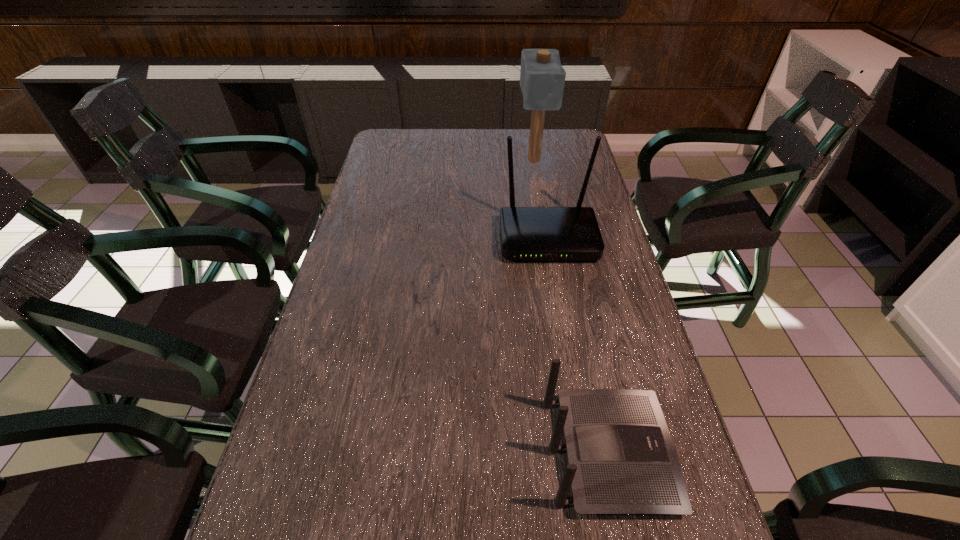
You are a GUI agent. You are given a task and a screenshot of the screen. Output one action in this format:
    pyautogui.click(x=<x>, y=<y>)
    Task: Click on the free point between the second nearest object and the mallet
    The width and height of the screenshot is (960, 540).
    Given the screenshot: What is the action you would take?
    pyautogui.click(x=540, y=199)

At what (x,y) coordinates should I click in order to perform the action: click on free spot between the nearest object and the mallet. Please return your answer as a coordinate pair (x, y). Looking at the image, I should click on (571, 306).

Where is `vacant area that lies between the second farthest object and the farthest object`? The image size is (960, 540). vacant area that lies between the second farthest object and the farthest object is located at coordinates pos(540,199).

This screenshot has width=960, height=540. What are the coordinates of `free area in between the taller router and the tallest object` in the screenshot? It's located at (540, 199).

Identify the location of free spot between the shortest object and the mallet. This screenshot has height=540, width=960. (571, 306).

Image resolution: width=960 pixels, height=540 pixels. In order to click on free spot between the farther router and the mallet in this screenshot , I will do `click(540, 199)`.

Identify which object is the second closest to the farthest object. Please provide its 2D coordinates. Your answer should be formatted as a tuple, i.e. [(x, y)], where the tuple contains the x and y coordinates of a point satisfying the conditions above.

[(621, 458)]

Locate which object is the closest to the second nearest object. Please provide its 2D coordinates. Your answer should be formatted as a tuple, i.e. [(x, y)], where the tuple contains the x and y coordinates of a point satisfying the conditions above.

[(542, 77)]

This screenshot has height=540, width=960. Find the location of `free space that satisfies the following two spatial constraints: 1. on the front-facing side of the shorter router; 2. on the front side of the tallest object`. free space that satisfies the following two spatial constraints: 1. on the front-facing side of the shorter router; 2. on the front side of the tallest object is located at coordinates (547, 160).

Locate an element on the screen. free space in the image that satisfies the following two spatial constraints: 1. on the front-facing side of the shorter router; 2. on the front-facing side of the taller router is located at coordinates (564, 239).